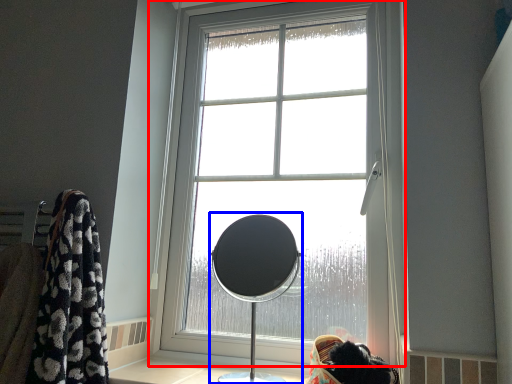
Question: Which object is closer to the camera taking this photo, window (highlighted by a red box) or table lamp (highlighted by a blue box)?

Choices:
 (A) window
 (B) table lamp

Answer: (B)